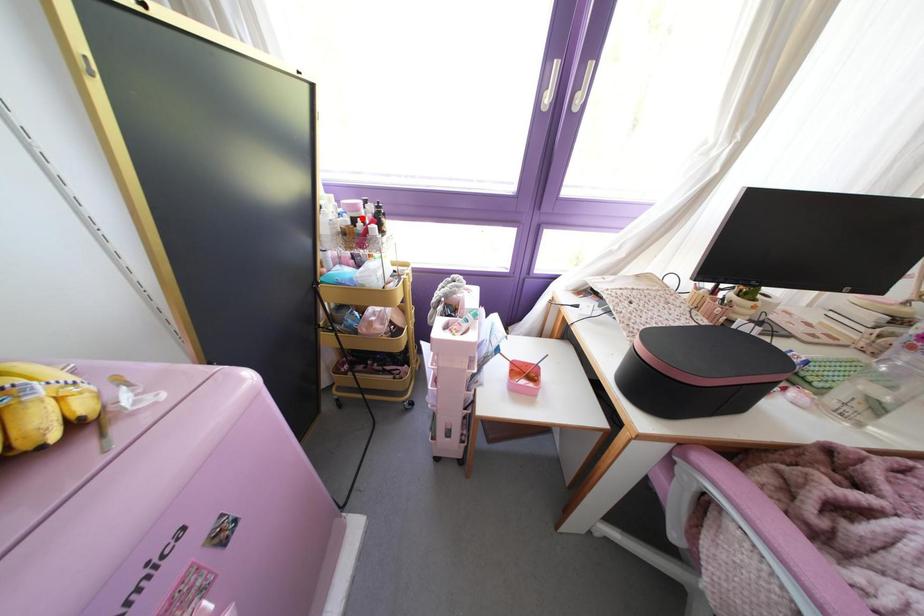
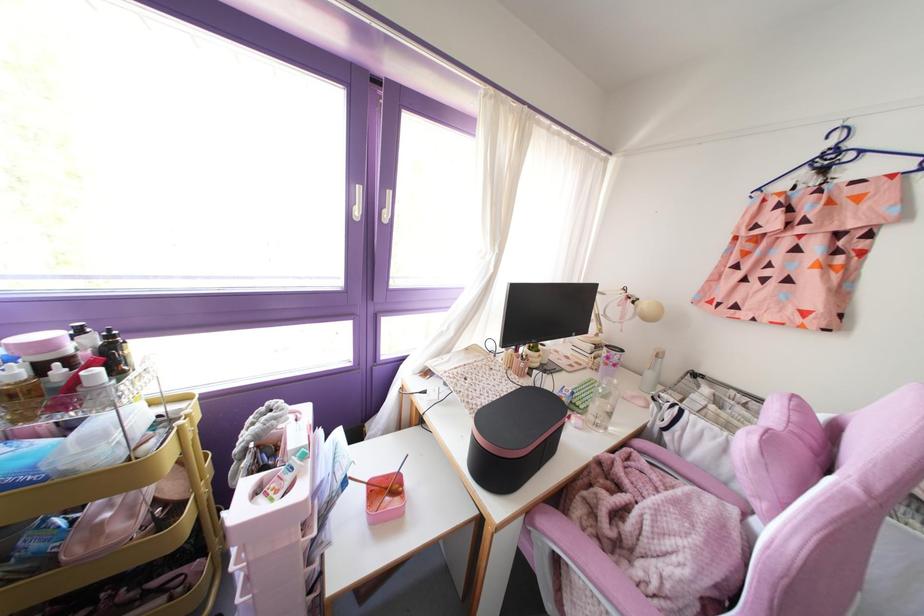
Question: I am providing you with two images of the same scene from different viewpoints. A red point is marked on the first image. Is the red point's position out of view in image 2?

Choices:
 (A) Yes
 (B) No

Answer: (B)